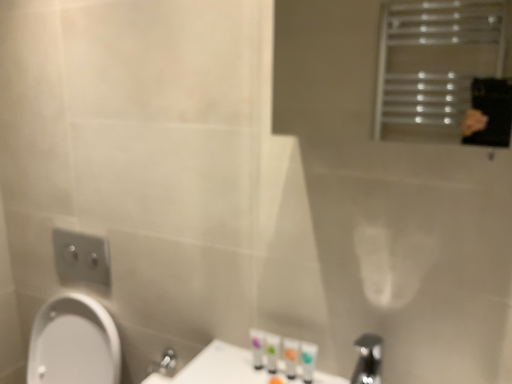
Question: Can we say white glossy tube at lower center, the first toiletry viewed from the right, lies outside silver metallic tap at lower right?

Choices:
 (A) no
 (B) yes

Answer: (B)

Question: Considering the relative sizes of white glossy tube at lower center, the first toiletry viewed from the right, and silver metallic tap at lower right in the image provided, is white glossy tube at lower center, the first toiletry viewed from the right, thinner than silver metallic tap at lower right?

Choices:
 (A) yes
 (B) no

Answer: (A)

Question: Would you say white glossy tube at lower center, the first toiletry viewed from the right, contains silver metallic tap at lower right?

Choices:
 (A) yes
 (B) no

Answer: (B)

Question: Is white glossy tube at lower center, which ranks as the fourth toiletry in left-to-right order, bigger than silver metallic tap at lower right?

Choices:
 (A) no
 (B) yes

Answer: (A)

Question: Is white glossy tube at lower center, the first toiletry viewed from the right, facing away from silver metallic tap at lower right?

Choices:
 (A) no
 (B) yes

Answer: (A)

Question: Relative to translucent plastic bottles at lower center, acting as the 4th toiletry starting from the right, is translucent plastic tubes at lower center, acting as the 3th toiletry starting from the left, in front or behind?

Choices:
 (A) behind
 (B) front

Answer: (B)

Question: Is translucent plastic tubes at lower center, acting as the 3th toiletry starting from the left, to the left or to the right of translucent plastic bottles at lower center, which is the first toiletry in left-to-right order, in the image?

Choices:
 (A) left
 (B) right

Answer: (B)

Question: Based on their sizes in the image, would you say translucent plastic tubes at lower center, acting as the 3th toiletry starting from the left, is bigger or smaller than translucent plastic bottles at lower center, which is the first toiletry in left-to-right order?

Choices:
 (A) small
 (B) big

Answer: (A)

Question: Is point (287, 374) positioned closer to the camera than point (259, 365)?

Choices:
 (A) farther
 (B) closer

Answer: (B)

Question: Considering the positions of translucent plastic tubes at lower center, the 2th toiletry in the left-to-right sequence, and translucent plastic tubes at lower center, acting as the 3th toiletry starting from the left, in the image, is translucent plastic tubes at lower center, the 2th toiletry in the left-to-right sequence, taller or shorter than translucent plastic tubes at lower center, acting as the 3th toiletry starting from the left,?

Choices:
 (A) short
 (B) tall

Answer: (A)

Question: From the image's perspective, is translucent plastic tubes at lower center, the 2th toiletry in the left-to-right sequence, positioned above or below translucent plastic tubes at lower center, acting as the 3th toiletry starting from the left?

Choices:
 (A) below
 (B) above

Answer: (B)

Question: Considering the positions of point (274, 362) and point (287, 339), is point (274, 362) closer or farther from the camera than point (287, 339)?

Choices:
 (A) farther
 (B) closer

Answer: (A)

Question: Considering the positions of translucent plastic tubes at lower center, the 3th toiletry when ordered from right to left, and translucent plastic tubes at lower center, acting as the 3th toiletry starting from the left, in the image, is translucent plastic tubes at lower center, the 3th toiletry when ordered from right to left, bigger or smaller than translucent plastic tubes at lower center, acting as the 3th toiletry starting from the left,?

Choices:
 (A) big
 (B) small

Answer: (A)

Question: In terms of width, does translucent plastic bottles at lower center, which is the first toiletry in left-to-right order, look wider or thinner when compared to translucent plastic tubes at lower center, acting as the 3th toiletry starting from the left?

Choices:
 (A) thin
 (B) wide

Answer: (B)

Question: From the image's perspective, is translucent plastic bottles at lower center, which is the first toiletry in left-to-right order, above or below translucent plastic tubes at lower center, acting as the 3th toiletry starting from the left?

Choices:
 (A) below
 (B) above

Answer: (B)